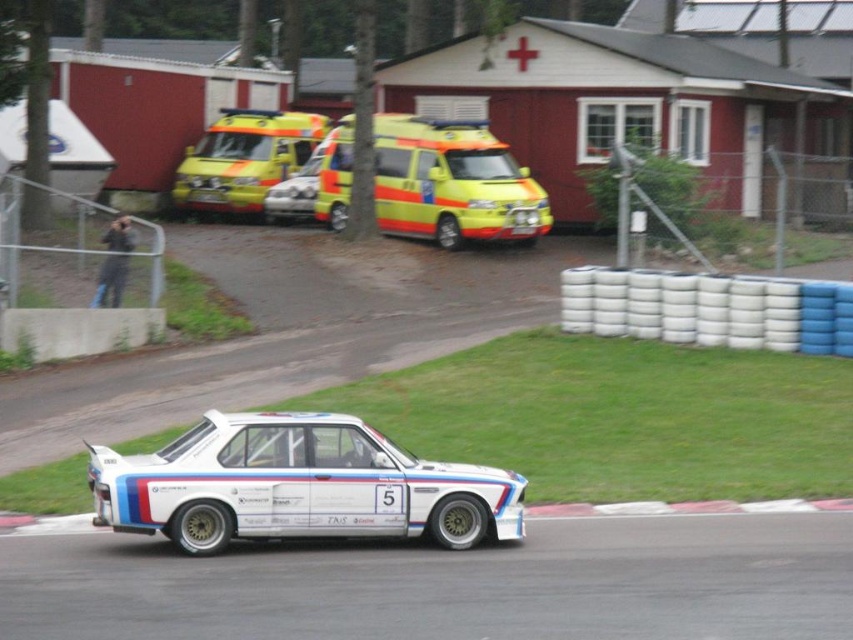
Question: Which of these objects is positioned closest to the yellow reflective van at center?

Choices:
 (A) white smooth asphalt at lower center
 (B) yellowmatteambulance at upper center
 (C) white glossy car at center

Answer: (B)

Question: Estimate the real-world distances between objects in this image. Which object is farther from the white glossy car at center?

Choices:
 (A) white smooth asphalt at lower center
 (B) yellowmatteambulance at upper center

Answer: (B)

Question: Is white smooth asphalt at lower center bigger than yellow reflective van at center?

Choices:
 (A) no
 (B) yes

Answer: (A)

Question: Does white smooth asphalt at lower center appear over yellowmatteambulance at upper center?

Choices:
 (A) no
 (B) yes

Answer: (A)

Question: Estimate the real-world distances between objects in this image. Which object is closer to the white smooth asphalt at lower center?

Choices:
 (A) yellow reflective van at center
 (B) white glossy car at center

Answer: (B)

Question: Is white smooth asphalt at lower center thinner than yellowmatteambulance at upper center?

Choices:
 (A) yes
 (B) no

Answer: (B)